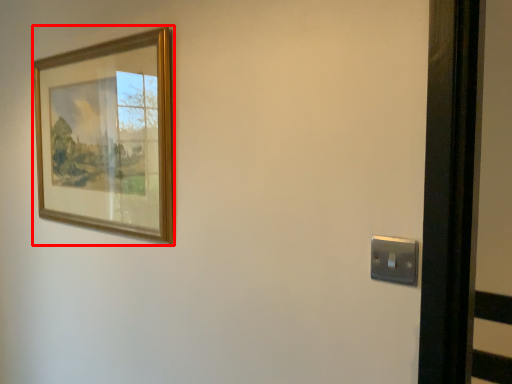
Question: Considering the relative positions of picture frame (annotated by the red box) and light switch in the image provided, where is picture frame (annotated by the red box) located with respect to the staircase?

Choices:
 (A) left
 (B) right

Answer: (A)